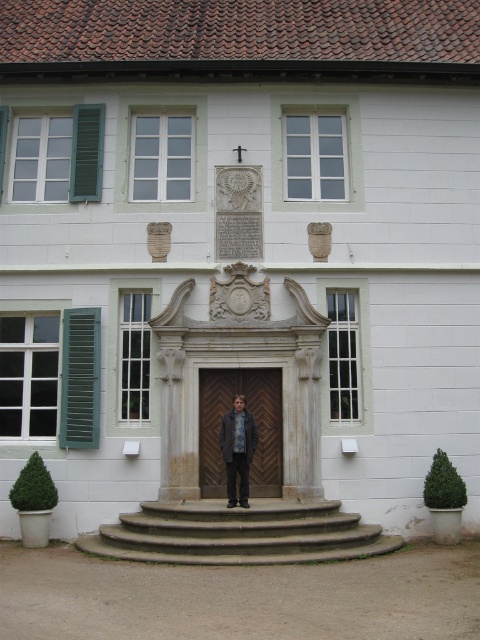
You are standing in front of a two story building with a traditional European style. You see a point marked at coordinates point (314,556). Can you determine if this point is closer to you than 12 meters?

The distance of point (314,556) from viewer is 11.95 meters, so yes, the point is closer than 12 meters.

You are standing in front of the building and want to enter through the central entrance. To your left, you see the green wooden shutter at left and the smooth concrete stairs at center. Which object is closer to the entrance?

The smooth concrete stairs at center are closer to the entrance because they are to the right of the green wooden shutter at left, which is further away.

You are standing at the base of the smooth concrete stairs at center and want to reach the green wooden shutter at left. According to the scene, which direction should you move to get closer to the shutter?

You should move upward because the smooth concrete stairs at center is located below the green wooden shutter at left, so moving upward along the stairs will bring you closer to the shutter.